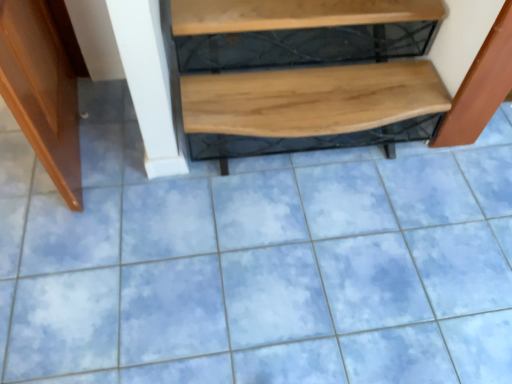
Question: Could you tell me if wooden bench at right is turned towards natural wood bench at center?

Choices:
 (A) no
 (B) yes

Answer: (A)

Question: Is the depth of wooden bench at right greater than that of natural wood bench at center?

Choices:
 (A) no
 (B) yes

Answer: (A)

Question: Is wooden bench at right not inside natural wood bench at center?

Choices:
 (A) yes
 (B) no

Answer: (A)

Question: Is wooden bench at right facing away from natural wood bench at center?

Choices:
 (A) yes
 (B) no

Answer: (B)

Question: From the image's perspective, does wooden bench at right appear higher than natural wood bench at center?

Choices:
 (A) yes
 (B) no

Answer: (B)

Question: Considering their positions, is natural wood bench at center located in front of or behind wooden at upper center?

Choices:
 (A) front
 (B) behind

Answer: (B)

Question: From the image's perspective, relative to wooden at upper center, is natural wood bench at center above or below?

Choices:
 (A) below
 (B) above

Answer: (A)

Question: From a real-world perspective, is natural wood bench at center positioned above or below wooden at upper center?

Choices:
 (A) below
 (B) above

Answer: (A)

Question: Is natural wood bench at center taller or shorter than wooden at upper center?

Choices:
 (A) tall
 (B) short

Answer: (A)

Question: Is point (48, 110) closer or farther from the camera than point (278, 92)?

Choices:
 (A) closer
 (B) farther

Answer: (A)

Question: Is shiny brown door at left in front of or behind natural wood bench at center in the image?

Choices:
 (A) front
 (B) behind

Answer: (A)

Question: Which is correct: shiny brown door at left is inside natural wood bench at center, or outside of it?

Choices:
 (A) inside
 (B) outside

Answer: (B)

Question: Considering the relative positions of shiny brown door at left and natural wood bench at center in the image provided, is shiny brown door at left to the left or to the right of natural wood bench at center?

Choices:
 (A) left
 (B) right

Answer: (A)

Question: Is wooden at upper center in front of or behind wooden bench at right in the image?

Choices:
 (A) front
 (B) behind

Answer: (B)

Question: Considering the positions of wooden at upper center and wooden bench at right in the image, is wooden at upper center bigger or smaller than wooden bench at right?

Choices:
 (A) big
 (B) small

Answer: (A)